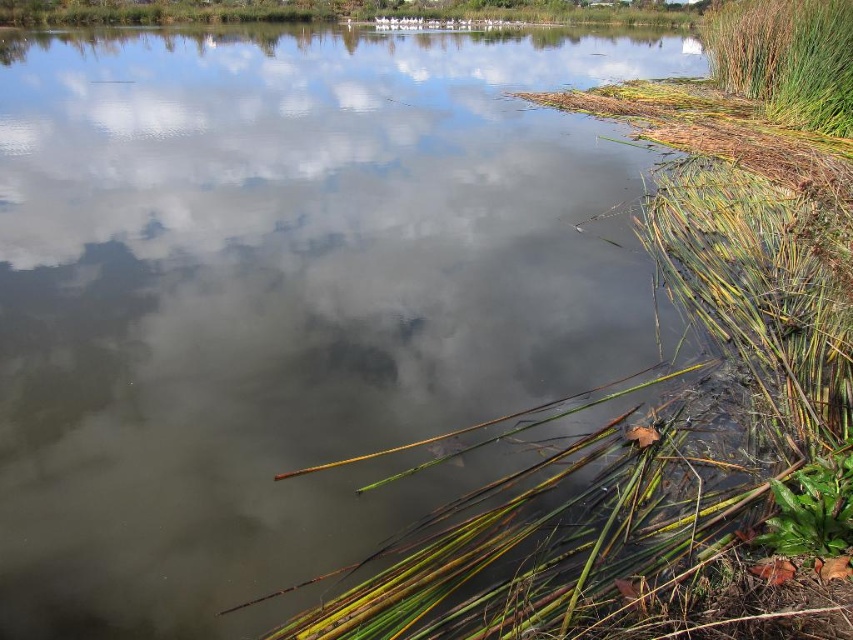
You are standing on the bank of the pond and want to step onto the green leafy plant at lower right. Is the green grass at right blocking your path?

Answer: The green grass at right is much taller than the green leafy plant at lower right, so it might block your path.

You are standing at the center of the image. Which direction should you move to reach the green grass at right?

Since the green grass at right is located at the right side of the image, you should move to the right to reach it.

In the scene shown: You are standing at the edge of the water body and want to reach the point marked at coordinates point (x=711, y=52). Given that your maximum wading depth is 5 feet, can you safely walk to that point without getting deeper than 5 feet?

The point (x=711, y=52) is 66.01 feet away from the viewer. Since your maximum wading depth is 5 feet, you cannot safely walk to that point without getting deeper than 5 feet.